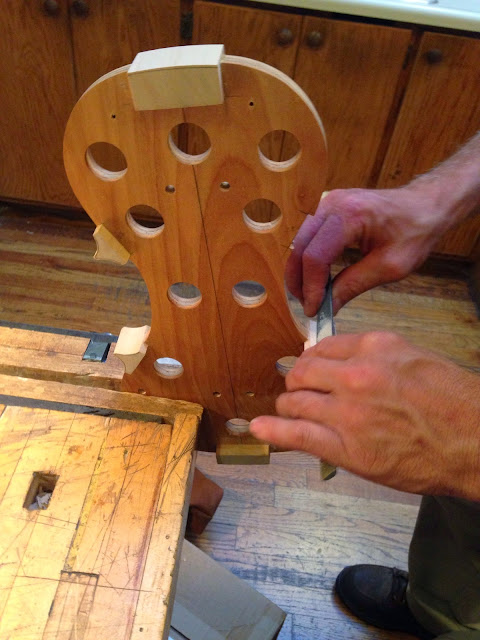
This screenshot has width=480, height=640. Identify the location of cupboard handles. (284, 41), (311, 38), (46, 10), (73, 9), (430, 54).